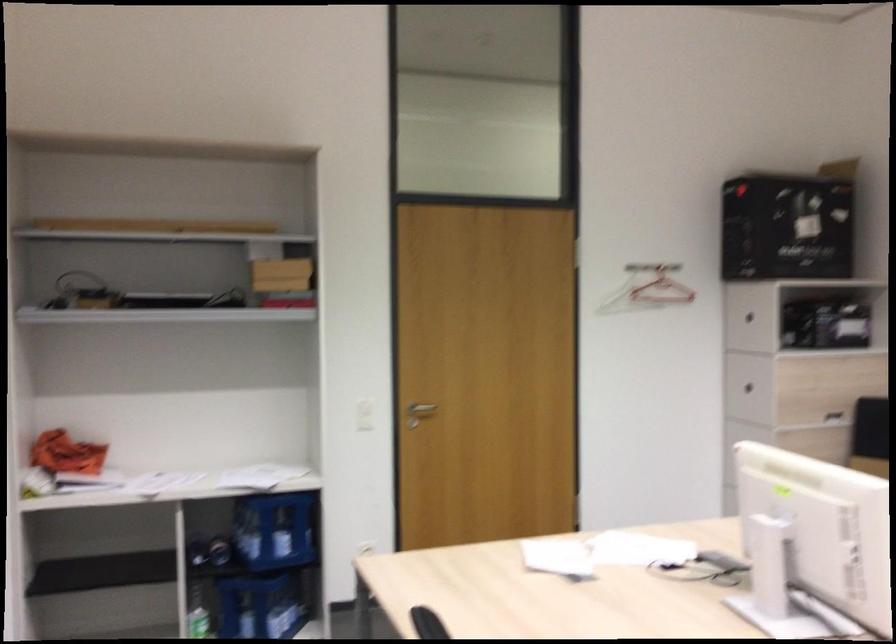
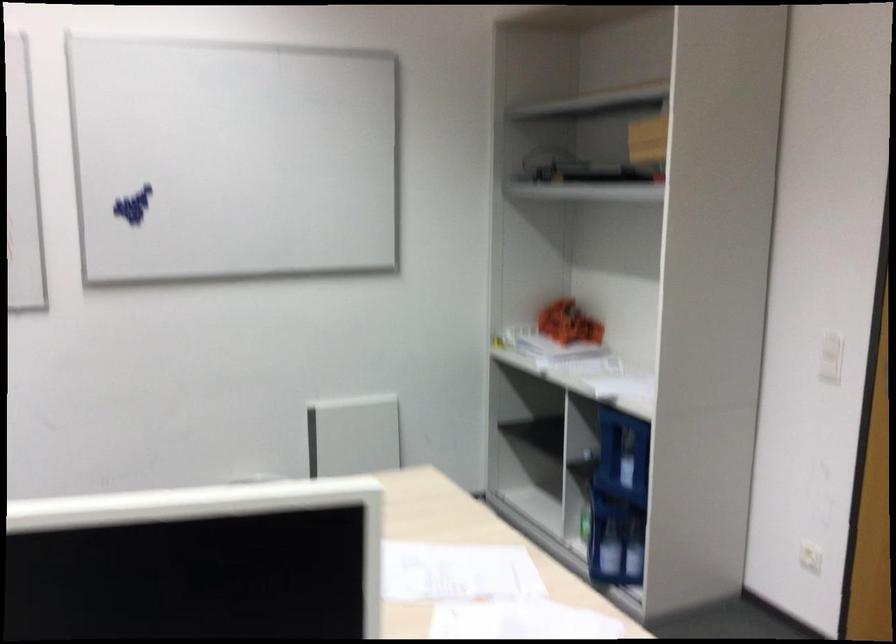
Locate, in the second image, the point that corresponds to the point at 334,430 in the first image.

(830, 357)